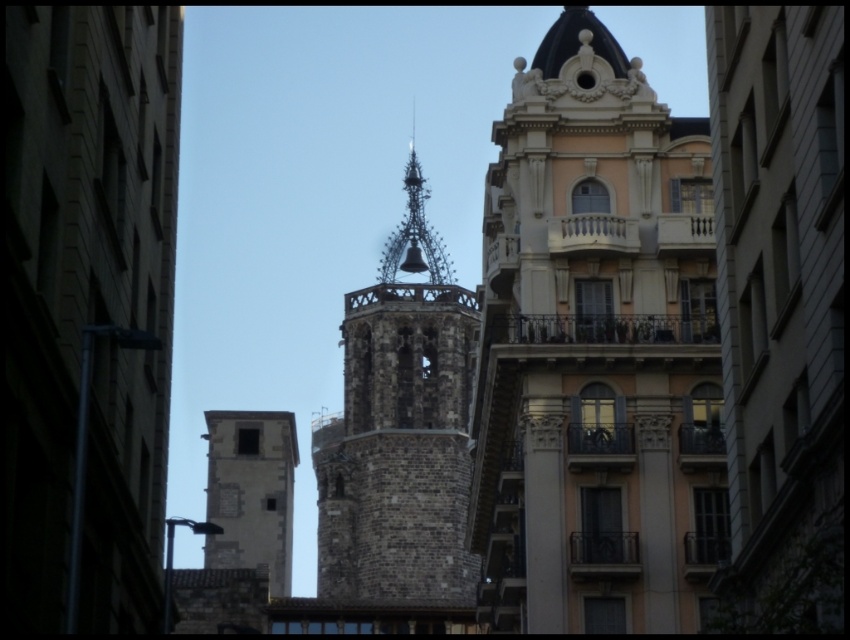
Who is taller, beige stone building at center or brick tower at center?

With more height is brick tower at center.

Is point (650, 477) positioned behind point (352, 387)?

That is False.

Identify the location of beige stone building at center. (596, 353).

Does brown stone tower at center have a smaller size compared to dark brown stone spire at center?

Incorrect, brown stone tower at center is not smaller in size than dark brown stone spire at center.

This screenshot has height=640, width=850. In order to click on brown stone tower at center in this screenshot , I will do `click(251, 492)`.

Between brick tower at center and brown stone tower at center, which one is positioned lower?

Positioned lower is brown stone tower at center.

This screenshot has width=850, height=640. What do you see at coordinates (400, 429) in the screenshot?
I see `brick tower at center` at bounding box center [400, 429].

Locate an element on the screen. This screenshot has width=850, height=640. brick tower at center is located at coordinates (400, 429).